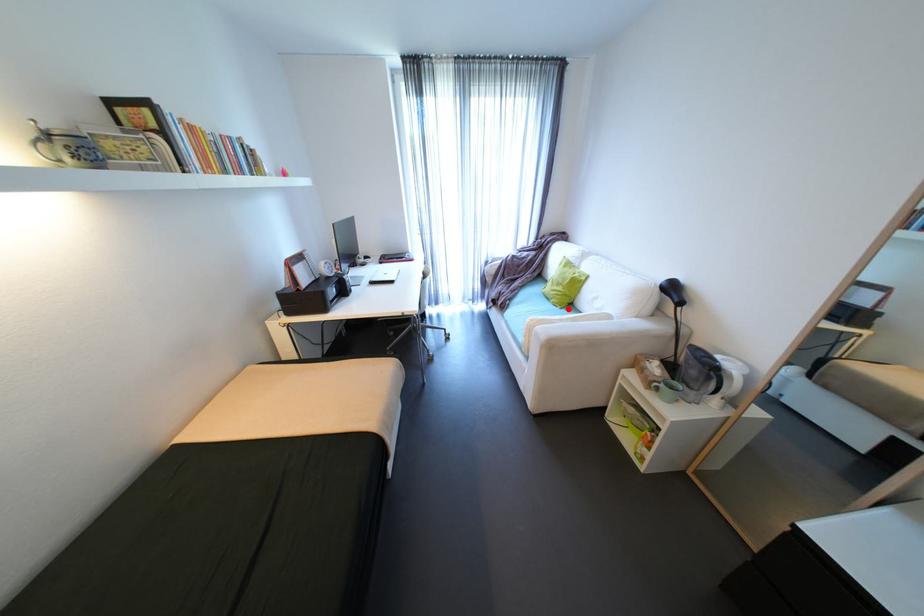
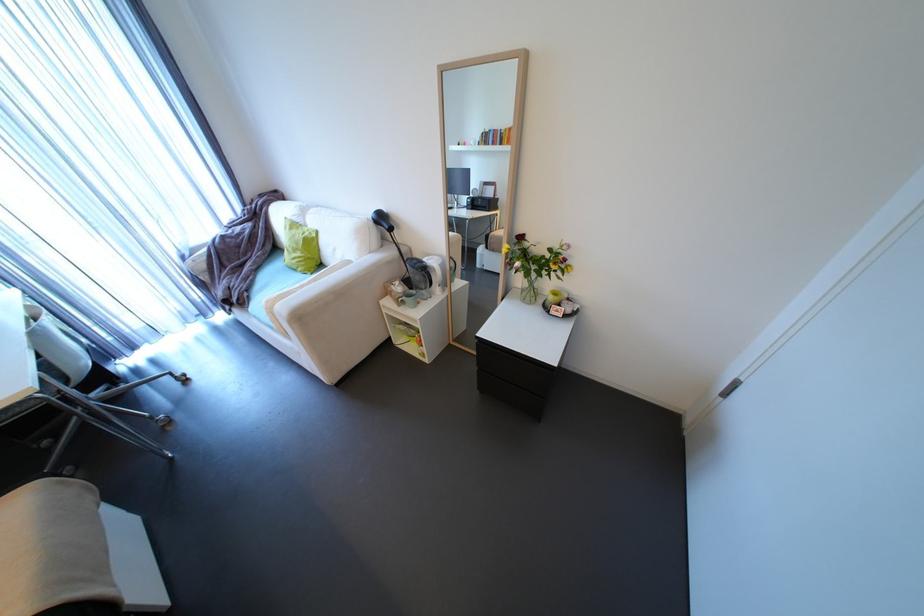
Where in the second image is the point corresponding to the highlighted location from the first image?

(319, 274)